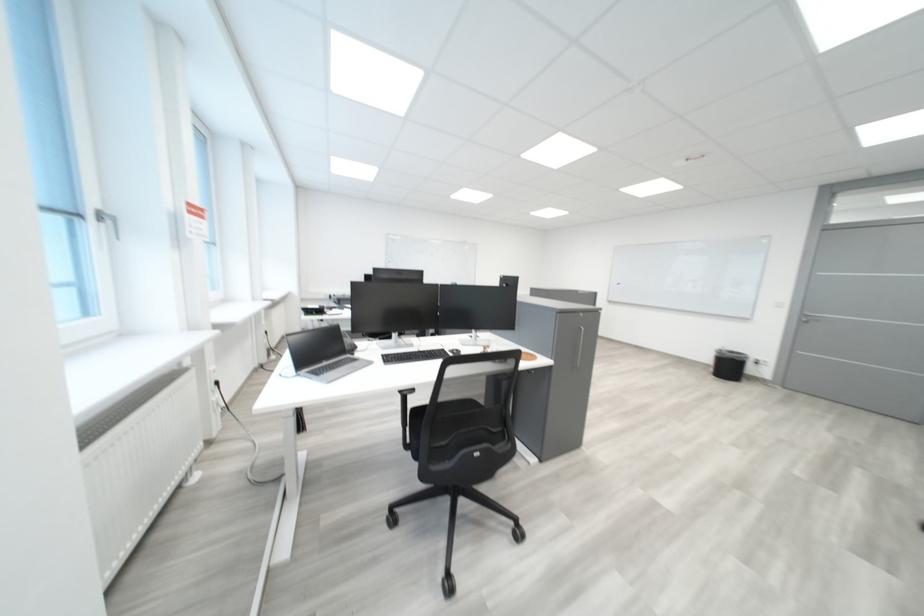
What do you see at coordinates (578, 347) in the screenshot? The width and height of the screenshot is (924, 616). I see `a grey cabinet handle` at bounding box center [578, 347].